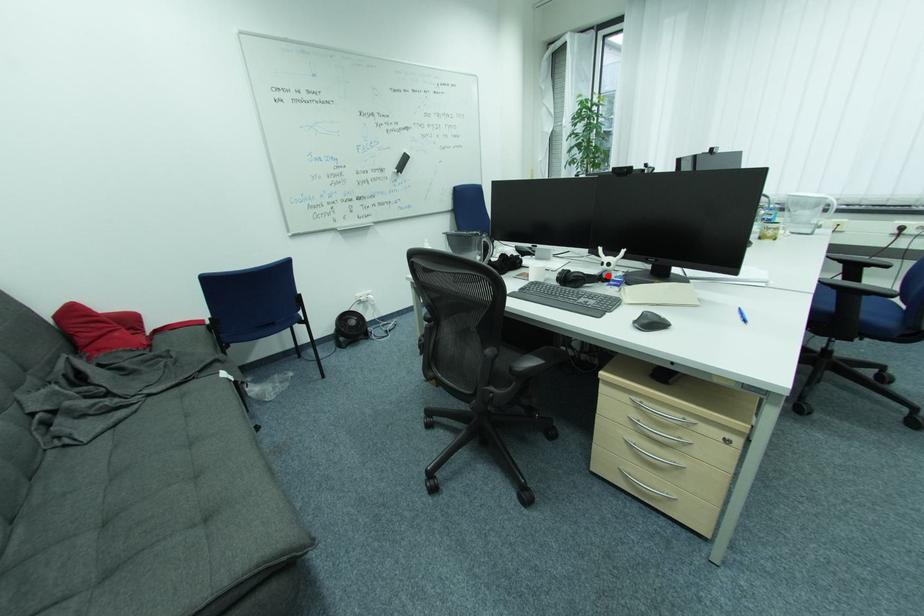
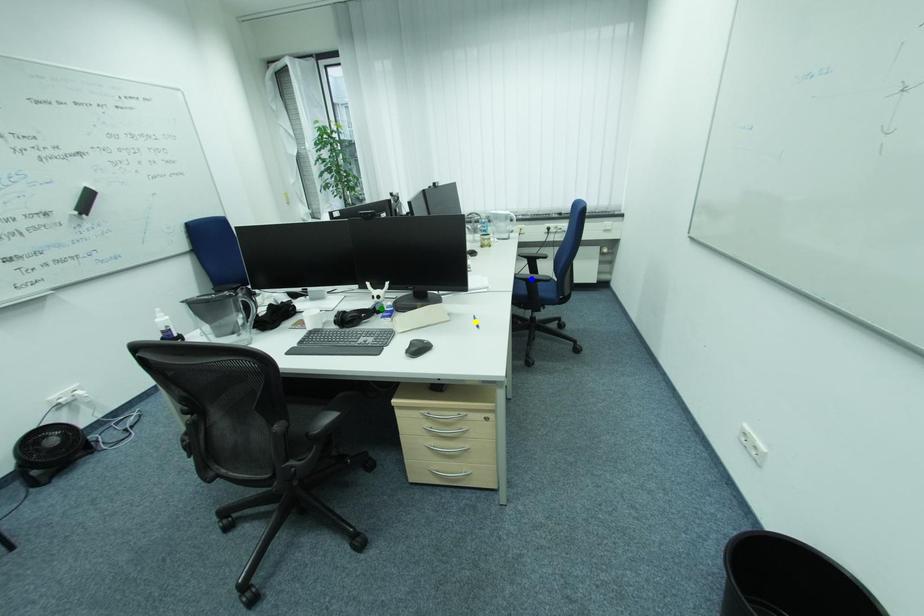
Question: I am providing you with two images of the same scene from different viewpoints. A red point is marked on the first image. You are given multiple points on the second image. Which mark in image 2 goes with the point in image 1?

Choices:
 (A) blue point
 (B) yellow point
 (C) green point

Answer: (C)